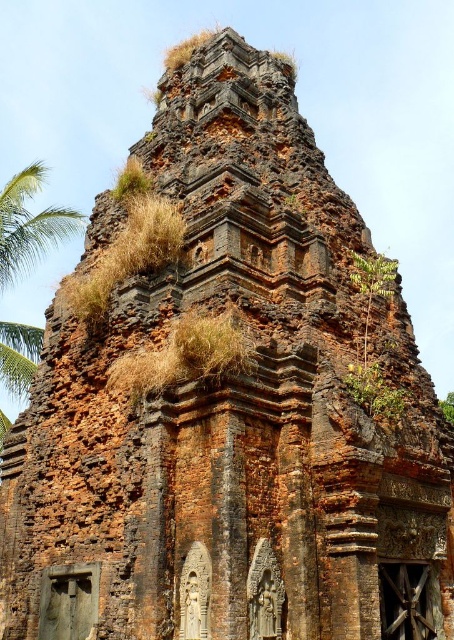
Question: Which point is farther to the camera?

Choices:
 (A) green leafy palm tree at upper left
 (B) green leafy plant at upper right

Answer: (A)

Question: From the image, what is the correct spatial relationship of green leafy palm tree at upper left in relation to green leafy plant at upper right?

Choices:
 (A) below
 (B) above

Answer: (B)

Question: Can you confirm if green leafy palm tree at upper left is bigger than green leafy plant at upper right?

Choices:
 (A) no
 (B) yes

Answer: (B)

Question: Which point is closer to the camera?

Choices:
 (A) (389, 262)
 (B) (19, 250)

Answer: (A)

Question: Is green leafy palm tree at upper left positioned behind green leafy plant at upper right?

Choices:
 (A) yes
 (B) no

Answer: (A)